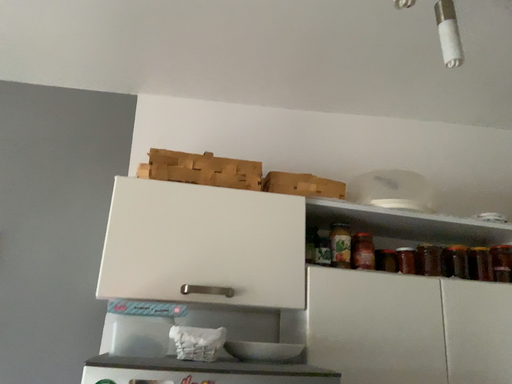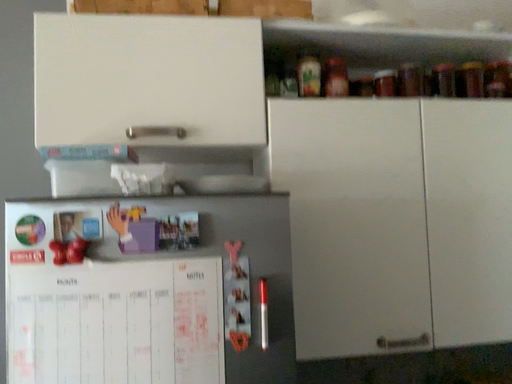
Question: How did the camera likely rotate when shooting the video?

Choices:
 (A) rotated downward
 (B) rotated upward

Answer: (A)